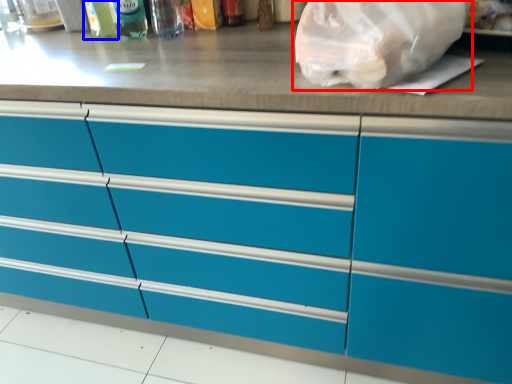
Question: Which object appears farthest to the camera in this image, plastic bag (highlighted by a red box) or bottle (highlighted by a blue box)?

Choices:
 (A) plastic bag
 (B) bottle

Answer: (B)